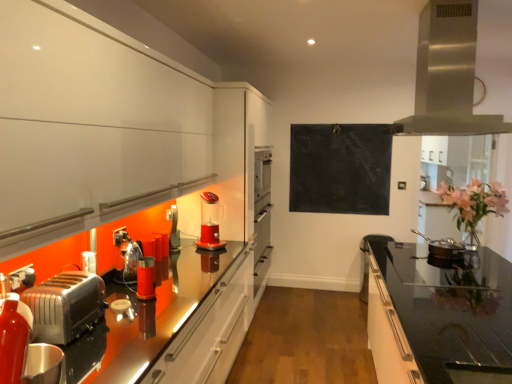
Describe the element at coordinates (443, 247) in the screenshot. The height and width of the screenshot is (384, 512). I see `shiny silver pan at right, the 2th appliance in the left-to-right sequence` at that location.

What is the approximate height of translucent plastic blender at center?

16.87 inches.

The height and width of the screenshot is (384, 512). Identify the location of pink floral bouquet at right. (474, 202).

The width and height of the screenshot is (512, 384). What do you see at coordinates (437, 315) in the screenshot? I see `black glass countertop at right` at bounding box center [437, 315].

The image size is (512, 384). Describe the element at coordinates (447, 74) in the screenshot. I see `stainless steel range hood at upper right` at that location.

Describe the element at coordinates (146, 278) in the screenshot. The height and width of the screenshot is (384, 512). I see `metallic red canister at center, the 2th appliance positioned from the right` at that location.

Locate an element on the screen. This screenshot has height=384, width=512. black matte chalkboard at upper center is located at coordinates 340,168.

Is metallic silver toaster at lower left oriented away from metallic red canister at center, positioned as the 1th appliance in front-to-back order?

metallic silver toaster at lower left is not turned away from metallic red canister at center, positioned as the 1th appliance in front-to-back order.

From a real-world perspective, between metallic silver toaster at lower left and metallic red canister at center, the 2th appliance positioned from the right, who is vertically lower?

metallic red canister at center, the 2th appliance positioned from the right.

Choose the correct answer: Is metallic silver toaster at lower left inside metallic red canister at center, arranged as the second appliance when viewed from the back, or outside it?

metallic silver toaster at lower left is not inside metallic red canister at center, arranged as the second appliance when viewed from the back, it's outside.

Consider the image. From the image's perspective, between metallic silver toaster at lower left and metallic red canister at center, positioned as the 1th appliance in front-to-back order, which one is located above?

metallic red canister at center, positioned as the 1th appliance in front-to-back order, appears higher in the image.

From the image's perspective, between black matte chalkboard at upper center and stainless steel range hood at upper right, who is located below?

black matte chalkboard at upper center, from the image's perspective.

Is black matte chalkboard at upper center in front of or behind stainless steel range hood at upper right in the image?

black matte chalkboard at upper center is behind stainless steel range hood at upper right.

Is black matte chalkboard at upper center oriented towards stainless steel range hood at upper right?

Yes.

Choose the correct answer: Is black matte chalkboard at upper center inside stainless steel range hood at upper right or outside it?

black matte chalkboard at upper center exists outside the volume of stainless steel range hood at upper right.

Looking at this image, between stainless steel range hood at upper right and black matte chalkboard at upper center, which one is positioned behind?

black matte chalkboard at upper center is more distant.

How distant is stainless steel range hood at upper right from black matte chalkboard at upper center?

The distance of stainless steel range hood at upper right from black matte chalkboard at upper center is 7.14 feet.

From the image's perspective, would you say stainless steel range hood at upper right is positioned over black matte chalkboard at upper center?

Yes, from the image's perspective, stainless steel range hood at upper right is above black matte chalkboard at upper center.

You are a GUI agent. You are given a task and a screenshot of the screen. Output one action in this format:
    pyautogui.click(x=<x>, y=<y>)
    Task: Click on the bulletin board to the left of stainless steel range hood at upper right
    
    Given the screenshot: What is the action you would take?
    pyautogui.click(x=340, y=168)

Is translucent plastic blender at center at the left side of black glass countertop at right?

Indeed, translucent plastic blender at center is positioned on the left side of black glass countertop at right.

Is translucent plastic blender at center in front of or behind black glass countertop at right in the image?

translucent plastic blender at center is behind black glass countertop at right.

Is point (212, 228) farther from viewer compared to point (473, 367)?

Yes, it is.

Can you confirm if translucent plastic blender at center is thinner than black glass countertop at right?

Correct, the width of translucent plastic blender at center is less than that of black glass countertop at right.

Identify the location of flower on the right of black matte chalkboard at upper center. The width and height of the screenshot is (512, 384). (474, 202).

Is pink floral bouquet at right not inside black matte chalkboard at upper center?

pink floral bouquet at right lies outside black matte chalkboard at upper center's area.

Which of these two, pink floral bouquet at right or black matte chalkboard at upper center, is smaller?

Smaller between the two is black matte chalkboard at upper center.

Are black glass countertop at right and pink floral bouquet at right beside each other?

There is a gap between black glass countertop at right and pink floral bouquet at right.

Consider the image. From the image's perspective, who appears lower, black glass countertop at right or pink floral bouquet at right?

black glass countertop at right.

Which is further, [462,290] or [492,209]?

The point [492,209] is farther.

Can you tell me how much black glass countertop at right and pink floral bouquet at right differ in facing direction?

179 degrees.

Which object is thinner, pink floral bouquet at right or translucent plastic blender at center?

translucent plastic blender at center.

Who is bigger, pink floral bouquet at right or translucent plastic blender at center?

Bigger between the two is pink floral bouquet at right.

Is pink floral bouquet at right completely or partially outside of translucent plastic blender at center?

pink floral bouquet at right is positioned outside translucent plastic blender at center.

Identify the location of toaster located above the metallic red canister at center, the 2th appliance positioned from the right (from a real-world perspective). (66, 306).

The image size is (512, 384). Find the location of `bulletin board behind the stainless steel range hood at upper right`. bulletin board behind the stainless steel range hood at upper right is located at coordinates (340, 168).

From the image, which object appears to be nearer to shiny silver pan at right, the 2th appliance in the left-to-right sequence, stainless steel range hood at upper right or pink floral bouquet at right?

Among the two, pink floral bouquet at right is located nearer to shiny silver pan at right, the 2th appliance in the left-to-right sequence.

When comparing their distances from pink floral bouquet at right, does stainless steel range hood at upper right or metallic silver toaster at lower left seem further?

metallic silver toaster at lower left lies further to pink floral bouquet at right than the other object.

Which object lies nearer to the anchor point stainless steel range hood at upper right, black matte chalkboard at upper center or shiny silver pan at right, which is counted as the first appliance, starting from the back?

shiny silver pan at right, which is counted as the first appliance, starting from the back, is closer to stainless steel range hood at upper right.

Which object lies nearer to the anchor point translucent plastic blender at center, black matte chalkboard at upper center or black glass countertop at right?

black glass countertop at right.

When comparing their distances from stainless steel range hood at upper right, does pink floral bouquet at right or shiny silver pan at right, the 2th appliance in the left-to-right sequence, seem further?

The object further to stainless steel range hood at upper right is shiny silver pan at right, the 2th appliance in the left-to-right sequence.

Which object lies further to the anchor point black matte chalkboard at upper center, black glass countertop at right or pink floral bouquet at right?

Based on the image, black glass countertop at right appears to be further to black matte chalkboard at upper center.

Considering their positions, is metallic silver toaster at lower left positioned closer to stainless steel range hood at upper right than shiny silver pan at right, the 2th appliance in the left-to-right sequence?

The object closer to stainless steel range hood at upper right is shiny silver pan at right, the 2th appliance in the left-to-right sequence.

Considering their positions, is metallic red canister at center, the 2th appliance positioned from the right, positioned further to stainless steel range hood at upper right than pink floral bouquet at right?

metallic red canister at center, the 2th appliance positioned from the right, is positioned further to the anchor stainless steel range hood at upper right.

This screenshot has height=384, width=512. Identify the location of countertop between metallic red canister at center, positioned as the 1th appliance in front-to-back order, and shiny silver pan at right, the 2th appliance in the left-to-right sequence, from left to right. (437, 315).

The width and height of the screenshot is (512, 384). Find the location of `home appliance positioned between black glass countertop at right and black matte chalkboard at upper center from near to far`. home appliance positioned between black glass countertop at right and black matte chalkboard at upper center from near to far is located at coordinates (447, 74).

Find the location of `home appliance between metallic red canister at center, the 2th appliance positioned from the right, and shiny silver pan at right, which is the 2th appliance in front-to-back order, in the horizontal direction`. home appliance between metallic red canister at center, the 2th appliance positioned from the right, and shiny silver pan at right, which is the 2th appliance in front-to-back order, in the horizontal direction is located at coordinates (447, 74).

You are a GUI agent. You are given a task and a screenshot of the screen. Output one action in this format:
    pyautogui.click(x=<x>, y=<y>)
    Task: Click on the flower between stainless steel range hood at upper right and black matte chalkboard at upper center along the z-axis
    This screenshot has height=384, width=512.
    Given the screenshot: What is the action you would take?
    pyautogui.click(x=474, y=202)